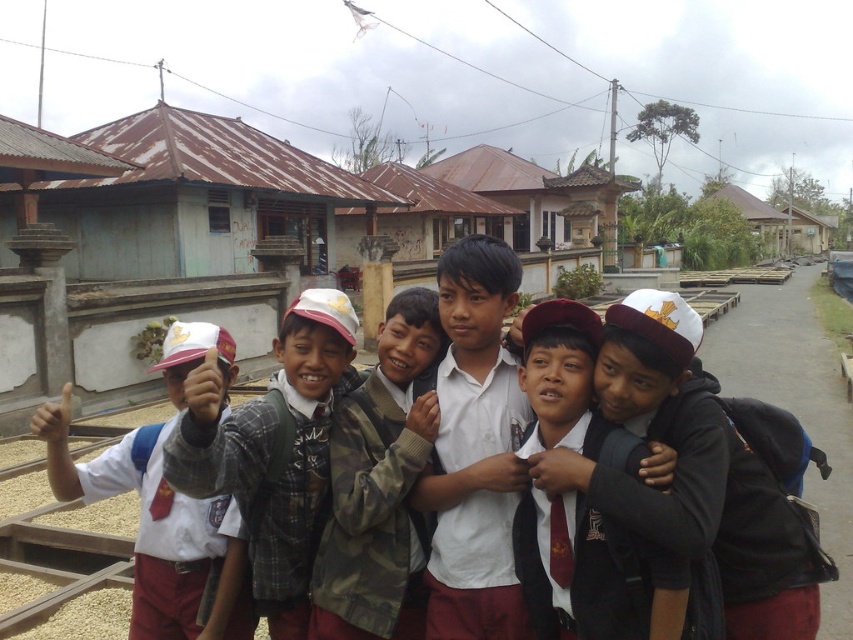
You are a photographer standing at the camera position. You want to take a closeup shot of the plaid shirt at center. Can you get a clear closeup without moving the camera or the shirt?

The plaid shirt at center is 6.17 feet away from camera, so yes, you can get a clear closeup shot without moving either since the distance is manageable for a zoom lens.

You are a photographer trying to capture the plaid shirt at center and the maroon uniform at center in a clear shot. Which one is closer to the camera?

The plaid shirt at center is in front of the maroon uniform at center, so it is closer to the camera.